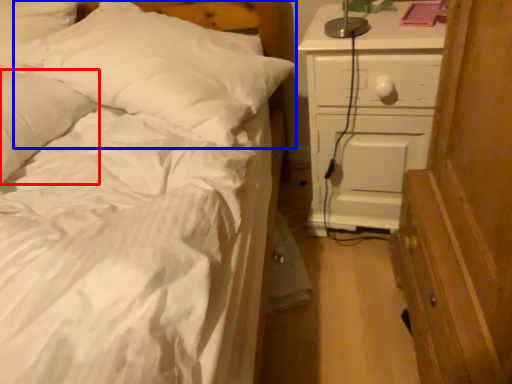
Question: Among these objects, which one is farthest to the camera, pillow (highlighted by a red box) or pillow (highlighted by a blue box)?

Choices:
 (A) pillow
 (B) pillow

Answer: (B)